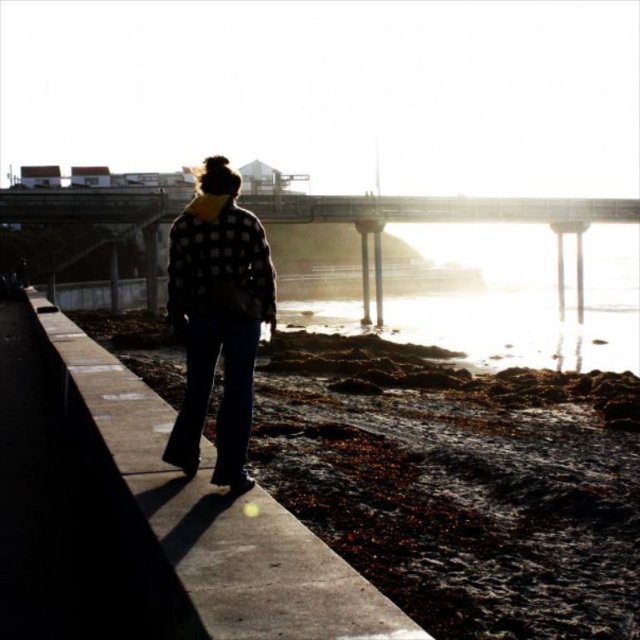
Does point (253, 634) lie behind point (218, 188)?

No, (253, 634) is closer to viewer.

Which is above, concrete at center or checkered fabric jacket at center?

Positioned higher is concrete at center.

Locate an element on the screen. The width and height of the screenshot is (640, 640). concrete at center is located at coordinates (220, 518).